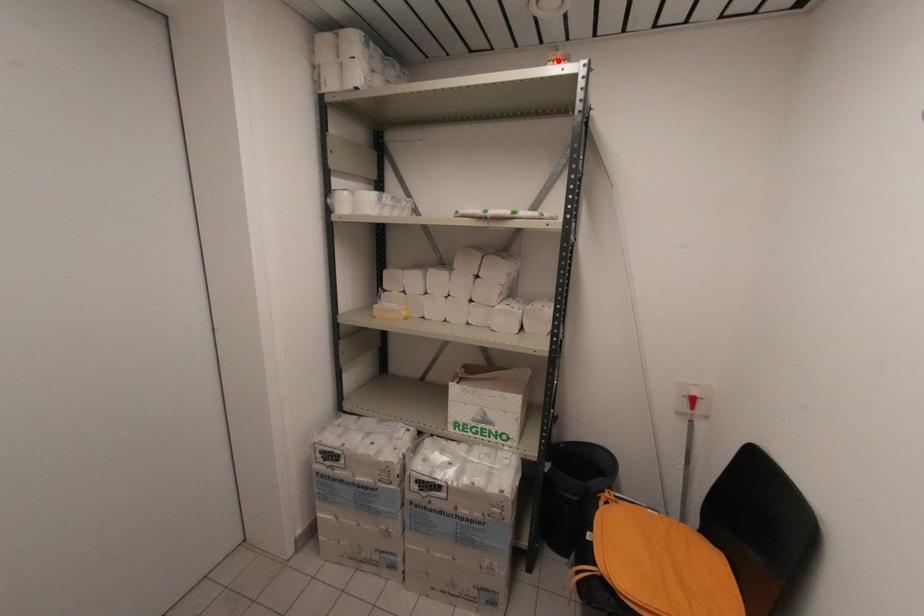
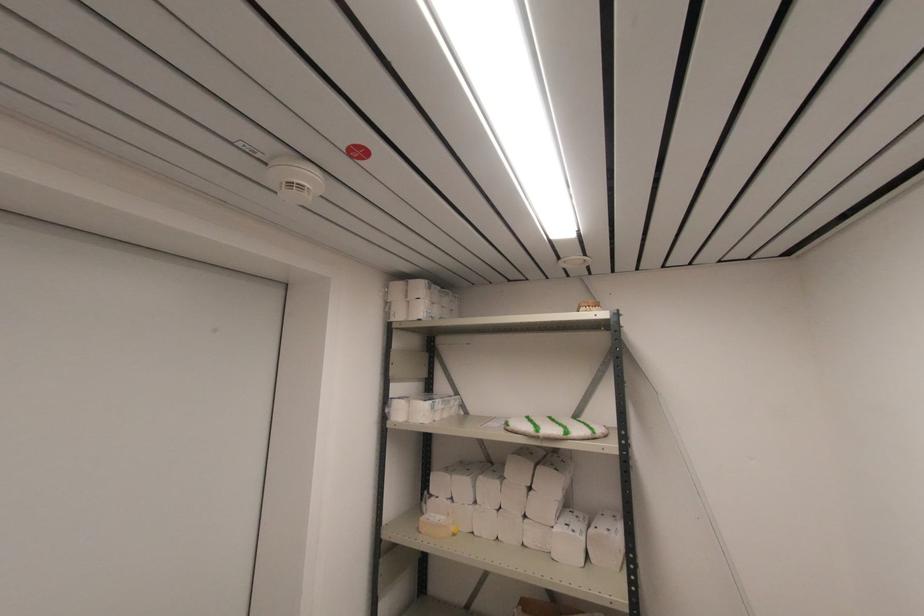
Where in the second image is the point corresponding to the highlighted location from the first image?

(590, 307)